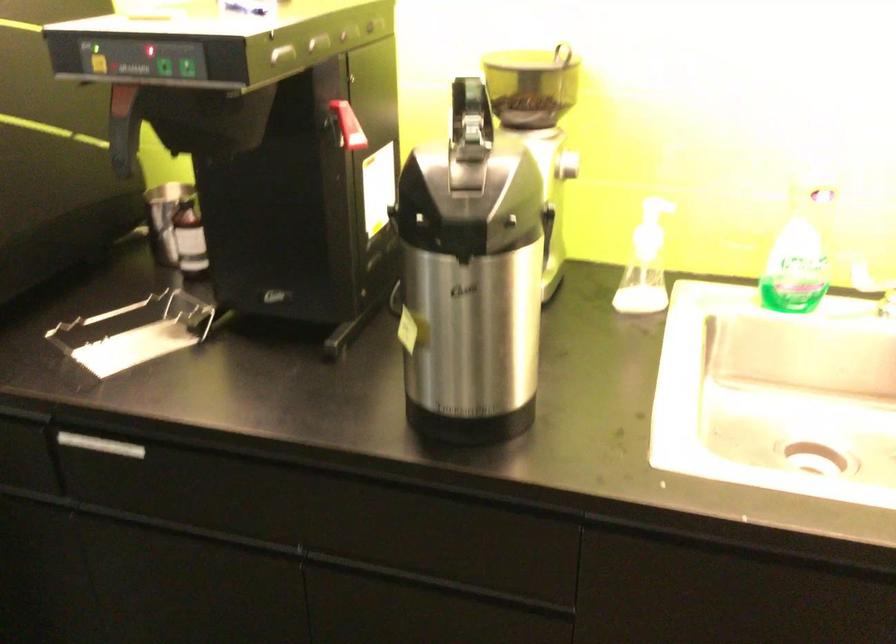
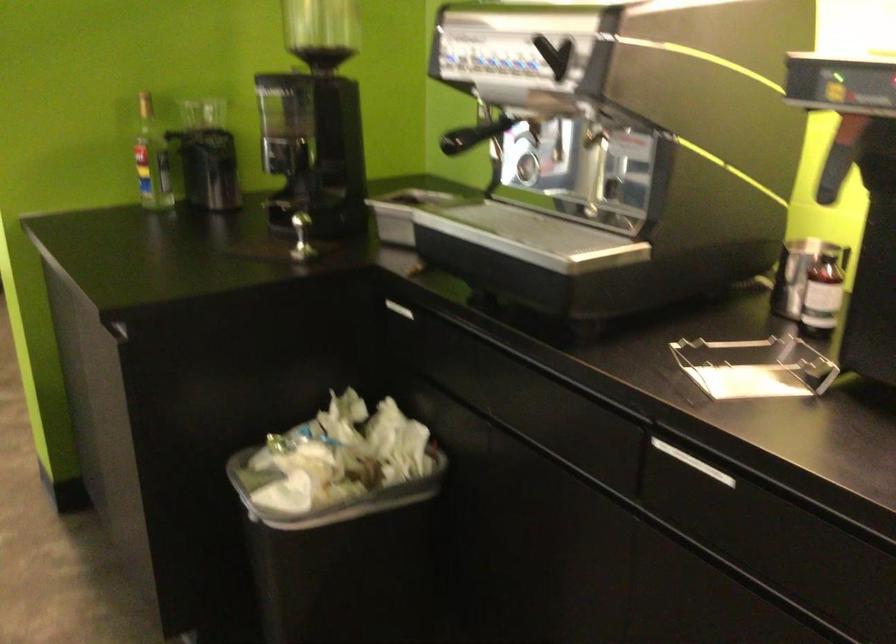
Question: How did the camera likely rotate?

Choices:
 (A) Left
 (B) Right
 (C) Up
 (D) Down

Answer: (A)